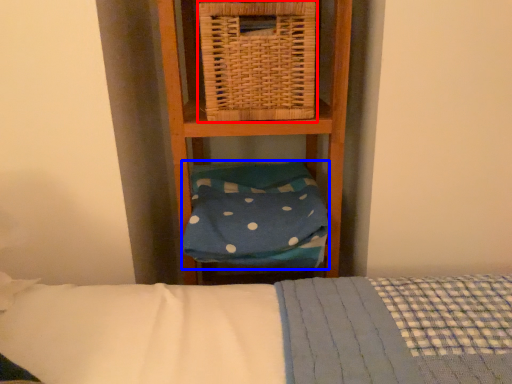
Question: Which object appears closest to the camera in this image, picnic basket (highlighted by a red box) or pillow (highlighted by a blue box)?

Choices:
 (A) picnic basket
 (B) pillow

Answer: (A)